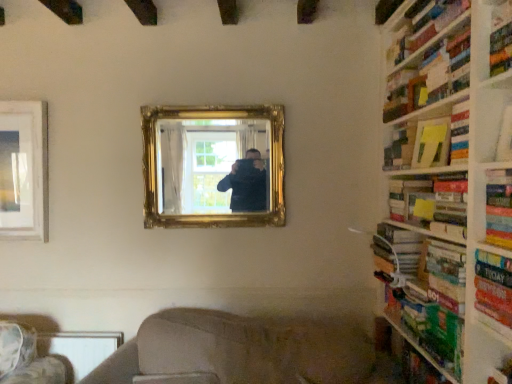
Where is `hardcover book at right, which is counted as the 3th book, starting from the top`? This screenshot has width=512, height=384. hardcover book at right, which is counted as the 3th book, starting from the top is located at coordinates (397, 249).

Describe the element at coordinates (492, 125) in the screenshot. I see `white paper at upper right, the 2th shelf when ordered from top to bottom` at that location.

Describe the element at coordinates (499, 38) in the screenshot. This screenshot has height=384, width=512. I see `hardcover book at upper right, marked as the third shelf in a bottom-to-top arrangement` at that location.

What are the coordinates of `beige fabric couch at lower center` in the screenshot? It's located at (241, 350).

You are a GUI agent. You are given a task and a screenshot of the screen. Output one action in this format:
    pyautogui.click(x=<x>, y=<y>)
    Task: Click on the hardcover book at right, which is counted as the 3th book, starting from the top
    This screenshot has width=512, height=384.
    Given the screenshot: What is the action you would take?
    pyautogui.click(x=397, y=249)

In the scene shown: Considering the sizes of hardcover book at right, which ranks as the 5th book in top-to-bottom order, and hardcover book at upper right, the second shelf in the back-to-front sequence, in the image, is hardcover book at right, which ranks as the 5th book in top-to-bottom order, bigger or smaller than hardcover book at upper right, the second shelf in the back-to-front sequence,?

hardcover book at right, which ranks as the 5th book in top-to-bottom order, is smaller than hardcover book at upper right, the second shelf in the back-to-front sequence.

Is hardcover book at right, the second book when ordered from bottom to top, facing away from hardcover book at upper right, arranged as the 2th shelf when viewed from the front?

No, hardcover book at right, the second book when ordered from bottom to top, is not facing away from hardcover book at upper right, arranged as the 2th shelf when viewed from the front.

Between point (446, 245) and point (511, 65), which one is positioned behind?

Point (446, 245)

Is hardcover book at right, which ranks as the 5th book in top-to-bottom order, not inside hardcover book at upper right, the second shelf in the back-to-front sequence?

Indeed, hardcover book at right, which ranks as the 5th book in top-to-bottom order, is completely outside hardcover book at upper right, the second shelf in the back-to-front sequence.

In the scene shown: From the image's perspective, which object appears higher, beige fabric couch at lower center or green matte book at right, positioned as the sixth book in top-to-bottom order?

green matte book at right, positioned as the sixth book in top-to-bottom order, appears higher in the image.

Considering the sizes of objects beige fabric couch at lower center and green matte book at right, positioned as the sixth book in top-to-bottom order, in the image provided, who is wider, beige fabric couch at lower center or green matte book at right, positioned as the sixth book in top-to-bottom order,?

Wider between the two is beige fabric couch at lower center.

Is beige fabric couch at lower center with green matte book at right, acting as the 1th book starting from the bottom?

beige fabric couch at lower center and green matte book at right, acting as the 1th book starting from the bottom, are clearly separated.

Could you tell me if beige fabric couch at lower center is turned towards green matte book at right, acting as the 1th book starting from the bottom?

No, beige fabric couch at lower center is not aimed at green matte book at right, acting as the 1th book starting from the bottom.

Are hardcover book at upper right, arranged as the 2th shelf when viewed from the front, and hardcover book at right, which is counted as the 3th book, starting from the top, far apart?

No, there isn't a large distance between hardcover book at upper right, arranged as the 2th shelf when viewed from the front, and hardcover book at right, which is counted as the 3th book, starting from the top.

In the scene shown: Is hardcover book at upper right, arranged as the 2th shelf when viewed from the front, oriented towards hardcover book at right, which is the fourth book from bottom to top?

No, hardcover book at upper right, arranged as the 2th shelf when viewed from the front, does not turn towards hardcover book at right, which is the fourth book from bottom to top.

From a real-world perspective, is hardcover book at upper right, marked as the third shelf in a bottom-to-top arrangement, physically located above or below hardcover book at right, which is counted as the 3th book, starting from the top?

hardcover book at upper right, marked as the third shelf in a bottom-to-top arrangement, is above hardcover book at right, which is counted as the 3th book, starting from the top.

From a real-world perspective, which is physically above, beige fabric couch at lower center or hardcover book at right, which is counted as the 3th book, starting from the top?

hardcover book at right, which is counted as the 3th book, starting from the top, from a real-world perspective.

Between beige fabric couch at lower center and hardcover book at right, which is counted as the 3th book, starting from the top, which one has smaller width?

hardcover book at right, which is counted as the 3th book, starting from the top, is thinner.

How different are the orientations of beige fabric couch at lower center and hardcover book at right, which is the fourth book from bottom to top, in degrees?

The angle between the facing direction of beige fabric couch at lower center and the facing direction of hardcover book at right, which is the fourth book from bottom to top, is 77.5 degrees.

Is beige fabric couch at lower center aimed at hardcover book at right, which is counted as the 3th book, starting from the top?

No, beige fabric couch at lower center is not aimed at hardcover book at right, which is counted as the 3th book, starting from the top.

Is white paper at upper right, positioned as the 1th shelf in front-to-back order, not close to gold ornate mirror at center?

white paper at upper right, positioned as the 1th shelf in front-to-back order, is far away from gold ornate mirror at center.

What are the coordinates of `the 3rd shelf to the right when counting from the gold ornate mirror at center` in the screenshot? It's located at (492, 125).

Considering the positions of points (496, 147) and (228, 211), is point (496, 147) farther from camera compared to point (228, 211)?

No, it is not.

Is white paper at upper right, positioned as the 1th shelf in front-to-back order, facing away from gold ornate mirror at center?

No, white paper at upper right, positioned as the 1th shelf in front-to-back order, is not facing the opposite direction of gold ornate mirror at center.

Looking at their sizes, would you say hardcover book at right, which is the fourth book from top to bottom, is wider or thinner than hardcover book at upper right, arranged as the 2th shelf when viewed from the front?

In the image, hardcover book at right, which is the fourth book from top to bottom, appears to be wider than hardcover book at upper right, arranged as the 2th shelf when viewed from the front.

You are a GUI agent. You are given a task and a screenshot of the screen. Output one action in this format:
    pyautogui.click(x=<x>, y=<y>)
    Task: Click on the 3rd book located beneath the hardcover book at upper right, which is the 1th shelf in top-to-bottom order (from a real-world perspective)
    
    Given the screenshot: What is the action you would take?
    pyautogui.click(x=494, y=290)

Is point (509, 263) positioned before point (494, 49)?

Yes.

Is hardcover book at right, the third book in the bottom-to-top sequence, with hardcover book at upper right, arranged as the 2th shelf when viewed from the front?

There is a gap between hardcover book at right, the third book in the bottom-to-top sequence, and hardcover book at upper right, arranged as the 2th shelf when viewed from the front.

Considering the relative sizes of metallic silver table at lower left and hardcover book at upper right, the second shelf in the back-to-front sequence, in the image provided, is metallic silver table at lower left smaller than hardcover book at upper right, the second shelf in the back-to-front sequence,?

No, metallic silver table at lower left is not smaller than hardcover book at upper right, the second shelf in the back-to-front sequence.

Can you tell me how much metallic silver table at lower left and hardcover book at upper right, which is the 1th shelf in top-to-bottom order, differ in facing direction?

The facing directions of metallic silver table at lower left and hardcover book at upper right, which is the 1th shelf in top-to-bottom order, are 90.3 degrees apart.

Based on the photo, from the image's perspective, which object appears higher, metallic silver table at lower left or hardcover book at upper right, the second shelf in the back-to-front sequence?

hardcover book at upper right, the second shelf in the back-to-front sequence, from the image's perspective.

Is hardcover book at upper right, the second shelf in the back-to-front sequence, a part of metallic silver table at lower left?

No.

The image size is (512, 384). I want to click on book that is the 3rd object located behind the hardcover book at upper right, arranged as the 2th shelf when viewed from the front, so click(445, 274).

Identify the location of couch below the green matte book at right, positioned as the sixth book in top-to-bottom order (from a real-world perspective). The image size is (512, 384). (241, 350).

When comparing their distances from hardcover book at right, marked as the second book in a top-to-bottom arrangement, does beige fabric couch at lower center or gold ornate mirror at center seem further?

Based on the image, gold ornate mirror at center appears to be further to hardcover book at right, marked as the second book in a top-to-bottom arrangement.

From the image, which object appears to be nearer to metallic silver table at lower left, green cardboard bookshelf at right, which is counted as the 3th shelf, starting from the front, or beige fabric couch at lower center?

beige fabric couch at lower center.

From the image, which object appears to be farther from hardcover book at upper right, acting as the first book starting from the top, green cardboard bookshelf at right, positioned as the 1th shelf in back-to-front order, or gold ornate mirror at center?

green cardboard bookshelf at right, positioned as the 1th shelf in back-to-front order, is further to hardcover book at upper right, acting as the first book starting from the top.

Which object lies further to the anchor point hardcover book at right, the third book in the bottom-to-top sequence, green cardboard bookshelf at right, which is counted as the 3th shelf, starting from the front, or yellow matte paper at upper right?

yellow matte paper at upper right.

Looking at the image, which one is located closer to green cardboard bookshelf at right, positioned as the 1th shelf in back-to-front order, white paper at upper right, which appears as the 2th shelf when ordered from the bottom, or beige fabric couch at lower center?

beige fabric couch at lower center.

Looking at the image, which one is located further to hardcover book at right, the second book when ordered from bottom to top, hardcover book at upper right, arranged as the 2th shelf when viewed from the front, or beige fabric couch at lower center?

beige fabric couch at lower center lies further to hardcover book at right, the second book when ordered from bottom to top, than the other object.

Looking at the image, which one is located further to hardcover book at right, the second book when ordered from bottom to top, hardcover book at right, which is counted as the 3th book, starting from the top, or white paper at upper right, positioned as the 1th shelf in front-to-back order?

white paper at upper right, positioned as the 1th shelf in front-to-back order, is positioned further to the anchor hardcover book at right, the second book when ordered from bottom to top.

When comparing their distances from green matte book at right, positioned as the sixth book in top-to-bottom order, does yellow matte paper at upper right or metallic silver table at lower left seem closer?

The object closer to green matte book at right, positioned as the sixth book in top-to-bottom order, is yellow matte paper at upper right.

At what (x,y) coordinates should I click in order to perform the action: click on couch between metallic silver table at lower left and green matte book at right, positioned as the sixth book in top-to-bottom order, from left to right. Please return your answer as a coordinate pair (x, y). Looking at the image, I should click on (241, 350).

Where is `bookcase between white paper at upper right, the 2th shelf when ordered from top to bottom, and hardcover book at right, the second book when ordered from bottom to top, in the front-back direction`? The width and height of the screenshot is (512, 384). bookcase between white paper at upper right, the 2th shelf when ordered from top to bottom, and hardcover book at right, the second book when ordered from bottom to top, in the front-back direction is located at coordinates (448, 186).

The width and height of the screenshot is (512, 384). What are the coordinates of `paperback book between metallic silver table at lower left and white paper at upper right, positioned as the 1th shelf in front-to-back order, from left to right` in the screenshot? It's located at [x=431, y=143].

The height and width of the screenshot is (384, 512). I want to click on shelf between hardcover book at upper right, the second shelf in the back-to-front sequence, and green cardboard bookshelf at right, which is counted as the 3th shelf, starting from the front, in the vertical direction, so click(492, 125).